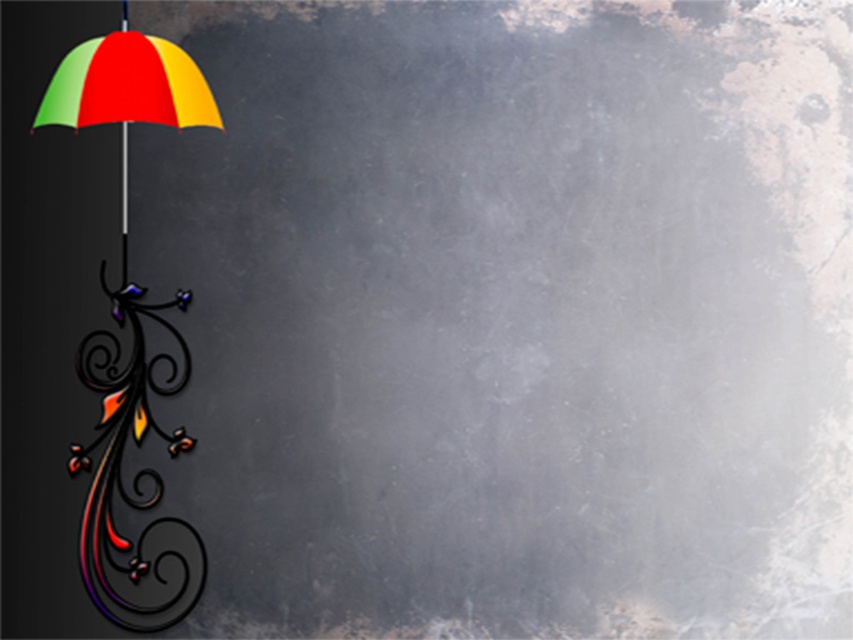
Looking at this image, you are an artist analyzing the composition of this image. You notice the metallic swirl at left and the multicolored glossy umbrella at left. Based on their positions, which object is closer to the left edge of the image?

The metallic swirl at left is closer to the left edge of the image because it is positioned to the left of the multicolored glossy umbrella at left.

You are an artist planning to place a new element in the center of the image. The multicolored glossy umbrella at left is located at point (126,92). Where should you place the new element to ensure it is centered?

The new element should be placed at the center of the image, which is typically at point 0.5, 0.5 in coordinate systems, ensuring it is centrally located compared to the multicolored glossy umbrella at left at (126,92).